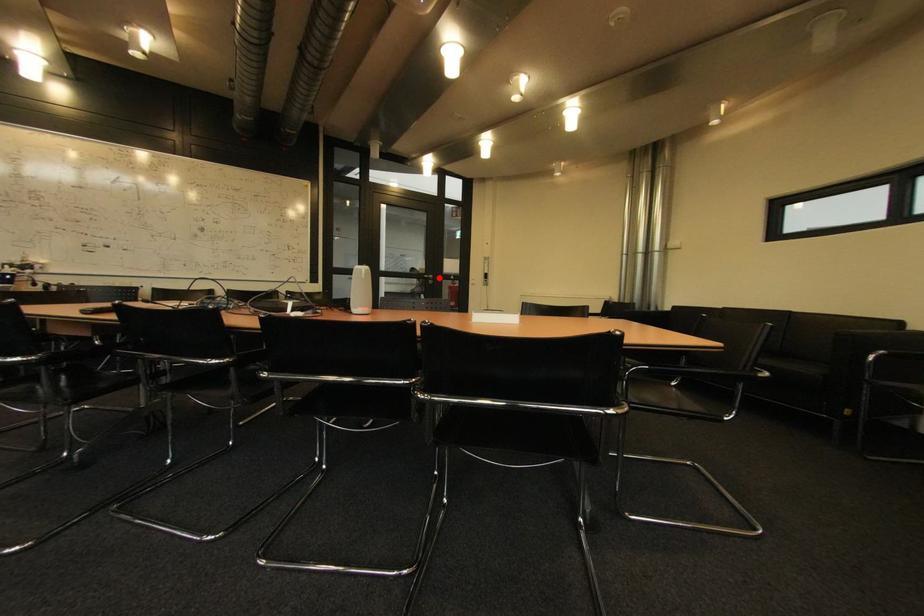
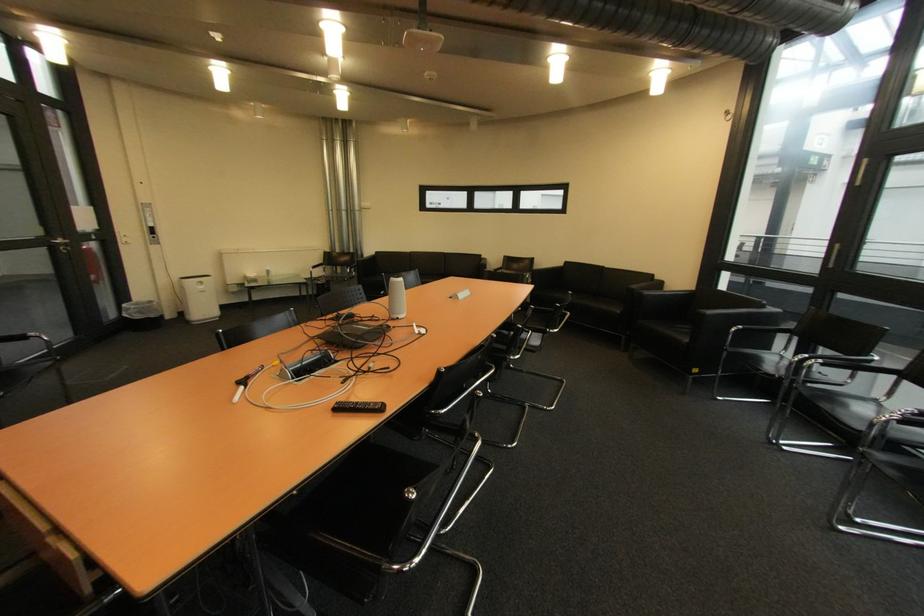
Locate, in the second image, the point that corresponds to the highlighted location in the first image.

(68, 241)